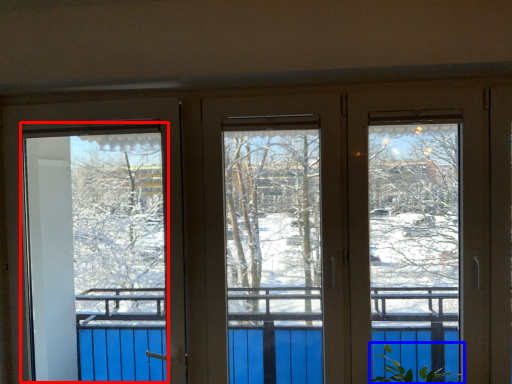
Question: Which point is further to the camera, screen door (highlighted by a red box) or plant (highlighted by a blue box)?

Choices:
 (A) screen door
 (B) plant

Answer: (A)